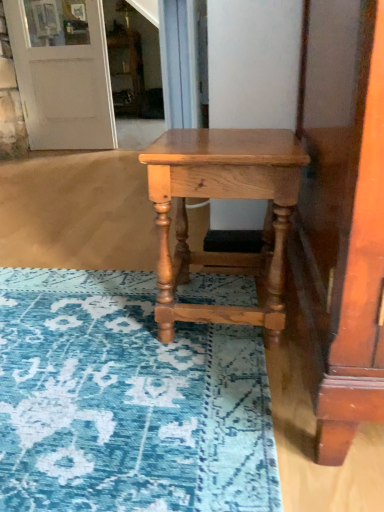
Describe the element at coordinates (223, 198) in the screenshot. I see `natural wood table at center` at that location.

Locate an element on the screen. natural wood table at center is located at coordinates (223, 198).

What is the approximate height of natural wood table at center?

natural wood table at center is 40.84 centimeters in height.

Describe the element at coordinates (64, 85) in the screenshot. The image size is (384, 512). I see `white matte door at upper left` at that location.

Where is `white matte door at upper left`? This screenshot has width=384, height=512. white matte door at upper left is located at coordinates (64, 85).

In order to face white matte door at upper left, should I rotate leftwards or rightwards?

You should rotate left by 16.701 degrees.

Identify the location of natural wood table at center. (x=223, y=198).

Is natural wood table at center at the right side of white matte door at upper left?

Correct, you'll find natural wood table at center to the right of white matte door at upper left.

Which is in front, natural wood table at center or white matte door at upper left?

Positioned in front is natural wood table at center.

Is point (259, 323) positioned after point (31, 96)?

No, it is in front of (31, 96).

From the image's perspective, relative to white matte door at upper left, is natural wood table at center above or below?

Based on their image positions, natural wood table at center is located beneath white matte door at upper left.

From a real-world perspective, between natural wood table at center and white matte door at upper left, who is vertically higher?

white matte door at upper left.

Considering the relative sizes of natural wood table at center and white matte door at upper left in the image provided, is natural wood table at center wider than white matte door at upper left?

Yes, natural wood table at center is wider than white matte door at upper left.

Considering the relative sizes of natural wood table at center and white matte door at upper left in the image provided, is natural wood table at center taller than white matte door at upper left?

Incorrect, the height of natural wood table at center is not larger of that of white matte door at upper left.

From the picture: Between natural wood table at center and white matte door at upper left, which one has smaller size?

natural wood table at center is smaller.

Can we say natural wood table at center lies outside white matte door at upper left?

Absolutely, natural wood table at center is external to white matte door at upper left.

Is natural wood table at center not near white matte door at upper left?

natural wood table at center is positioned a significant distance from white matte door at upper left.

Could you tell me if natural wood table at center is turned towards white matte door at upper left?

No, natural wood table at center is not oriented towards white matte door at upper left.

From the picture: Measure the distance between natural wood table at center and white matte door at upper left.

natural wood table at center and white matte door at upper left are 7.09 feet apart.

Image resolution: width=384 pixels, height=512 pixels. In order to click on door above the natural wood table at center (from a real-world perspective) in this screenshot , I will do `click(64, 85)`.

Visually, is white matte door at upper left positioned to the left or to the right of natural wood table at center?

white matte door at upper left is positioned on natural wood table at center's left side.

Which object is further away from the camera, white matte door at upper left or natural wood table at center?

white matte door at upper left is behind.

Does point (69, 52) lie in front of point (155, 180)?

That is False.

From the image's perspective, is white matte door at upper left beneath natural wood table at center?

No, from the image's perspective, white matte door at upper left is not beneath natural wood table at center.

From a real-world perspective, is white matte door at upper left positioned under natural wood table at center based on gravity?

No, from a real-world perspective, white matte door at upper left is not below natural wood table at center.

Which of these two, white matte door at upper left or natural wood table at center, is wider?

natural wood table at center.

Who is shorter, white matte door at upper left or natural wood table at center?

With less height is natural wood table at center.

Considering the sizes of objects white matte door at upper left and natural wood table at center in the image provided, who is smaller, white matte door at upper left or natural wood table at center?

natural wood table at center.

Would you say white matte door at upper left is outside natural wood table at center?

Yes, white matte door at upper left is not within natural wood table at center.

Is white matte door at upper left not near natural wood table at center?

Yes, white matte door at upper left and natural wood table at center are located far from each other.

Is white matte door at upper left turned away from natural wood table at center?

white matte door at upper left does not have its back to natural wood table at center.

What's the angular difference between white matte door at upper left and natural wood table at center's facing directions?

The angle between the facing direction of white matte door at upper left and the facing direction of natural wood table at center is 0.574 degrees.

From the picture: How far apart are white matte door at upper left and natural wood table at center?

white matte door at upper left is 2.16 meters from natural wood table at center.

You are a GUI agent. You are given a task and a screenshot of the screen. Output one action in this format:
    pyautogui.click(x=<x>, y=<y>)
    Task: Click on the door above the natural wood table at center (from the image's perspective)
    This screenshot has width=384, height=512.
    Given the screenshot: What is the action you would take?
    pyautogui.click(x=64, y=85)

I want to click on door lying above the natural wood table at center (from the image's perspective), so click(64, 85).

Locate an element on the screen. This screenshot has width=384, height=512. table located below the white matte door at upper left (from the image's perspective) is located at coordinates (223, 198).